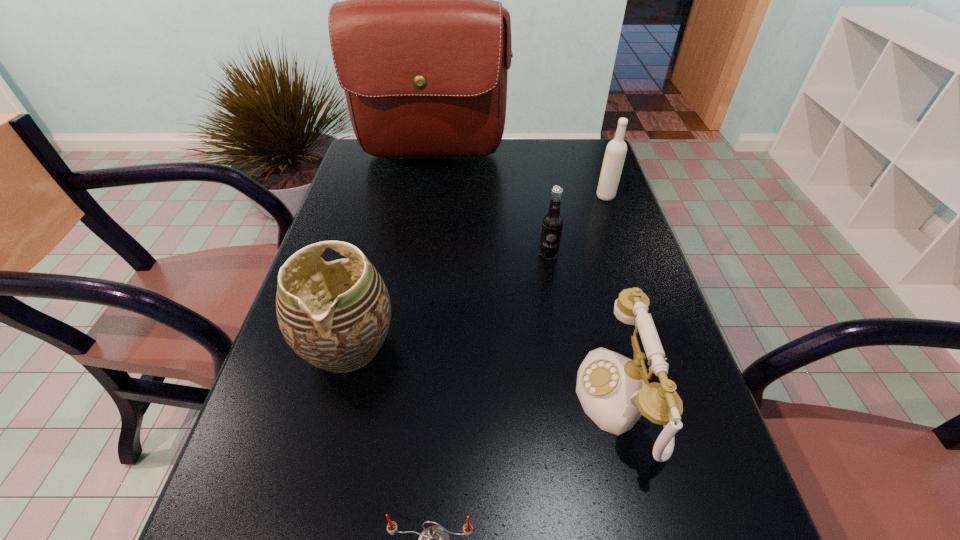
Where is `free space at the left edge of the desktop`? free space at the left edge of the desktop is located at coordinates (271, 475).

You are a GUI agent. You are given a task and a screenshot of the screen. Output one action in this format:
    pyautogui.click(x=<x>, y=<y>)
    Task: Click on the free spot at the right edge of the desktop
    The height and width of the screenshot is (540, 960).
    Given the screenshot: What is the action you would take?
    pyautogui.click(x=677, y=536)

The image size is (960, 540). In order to click on vacant space at the far right corner in this screenshot , I will do `click(588, 148)`.

At what (x,y) coordinates should I click in order to perform the action: click on free space between the pottery and the telephone. Please return your answer as a coordinate pair (x, y). Looking at the image, I should click on [484, 373].

Locate an element on the screen. This screenshot has width=960, height=540. vacant area that lies between the pottery and the vodka is located at coordinates (477, 271).

Locate an element on the screen. The height and width of the screenshot is (540, 960). free space between the second farthest object and the satchel is located at coordinates (518, 177).

Where is `free space between the farthest object and the second farthest object`? free space between the farthest object and the second farthest object is located at coordinates (518, 177).

Locate an element on the screen. This screenshot has height=540, width=960. blank region between the telephone and the fifth nearest object is located at coordinates (612, 298).

The height and width of the screenshot is (540, 960). I want to click on vacant space that is in between the pottery and the satchel, so click(390, 252).

Find the location of a particular element. This screenshot has width=960, height=540. object that is the fourth closest to the pottery is located at coordinates (421, 48).